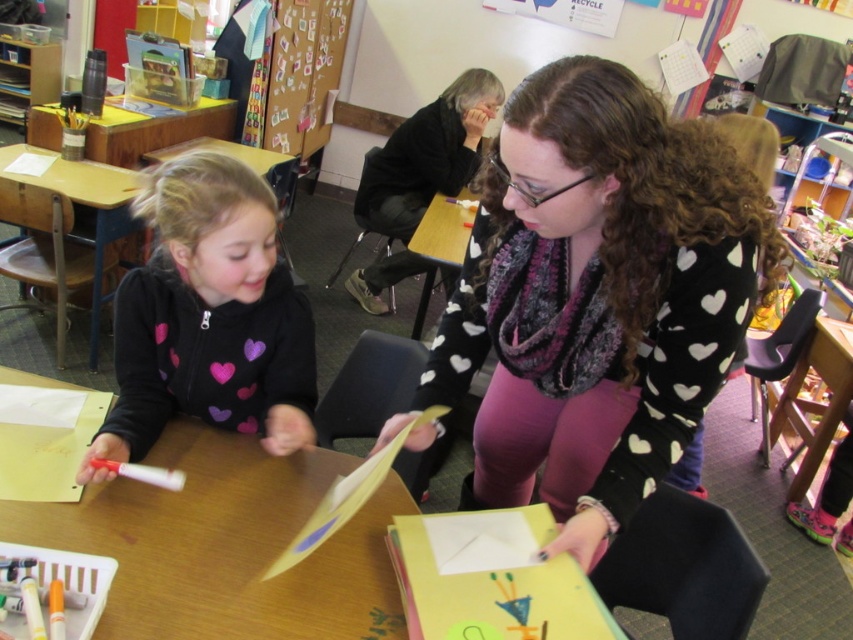
Is point (630, 506) closer to viewer compared to point (164, 118)?

Yes, it is in front of point (164, 118).

This screenshot has height=640, width=853. In order to click on black heart-patterned sweater at center in this screenshot , I will do `click(598, 296)`.

Is point (608, 360) farther from viewer compared to point (125, 108)?

That is False.

This screenshot has height=640, width=853. In order to click on black heart-patterned sweater at center in this screenshot , I will do coord(598,296).

Looking at this image, how far apart are yellow paper at center and wooden desk at upper left?

yellow paper at center is 2.35 meters away from wooden desk at upper left.

Can you confirm if yellow paper at center is smaller than wooden desk at upper left?

Yes.

The image size is (853, 640). Describe the element at coordinates (227, 545) in the screenshot. I see `yellow paper at center` at that location.

In order to click on yellow paper at center in this screenshot , I will do `click(227, 545)`.

Does black heart-patterned sweater at center have a larger size compared to black heart-patterned sweater at left?

Yes.

Who is shorter, black heart-patterned sweater at center or black heart-patterned sweater at left?

black heart-patterned sweater at left

Identify the location of black heart-patterned sweater at center. (598, 296).